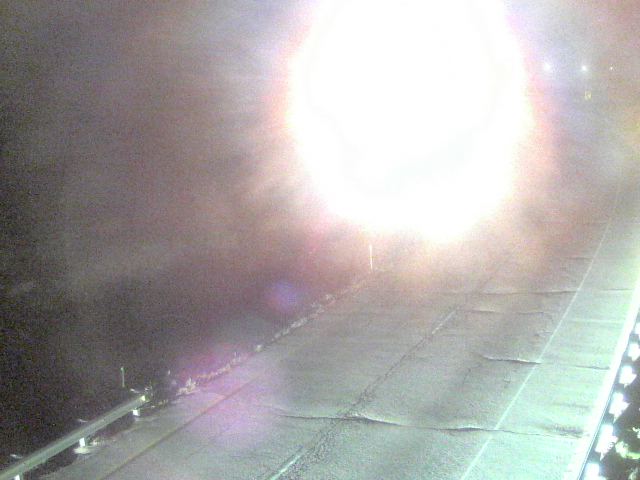
Identify the location of light. pos(450,134).